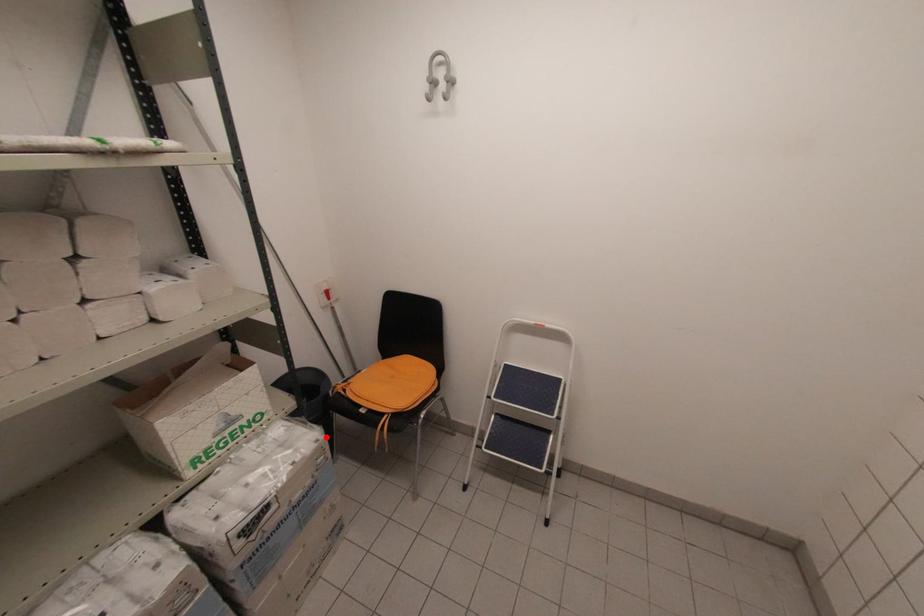
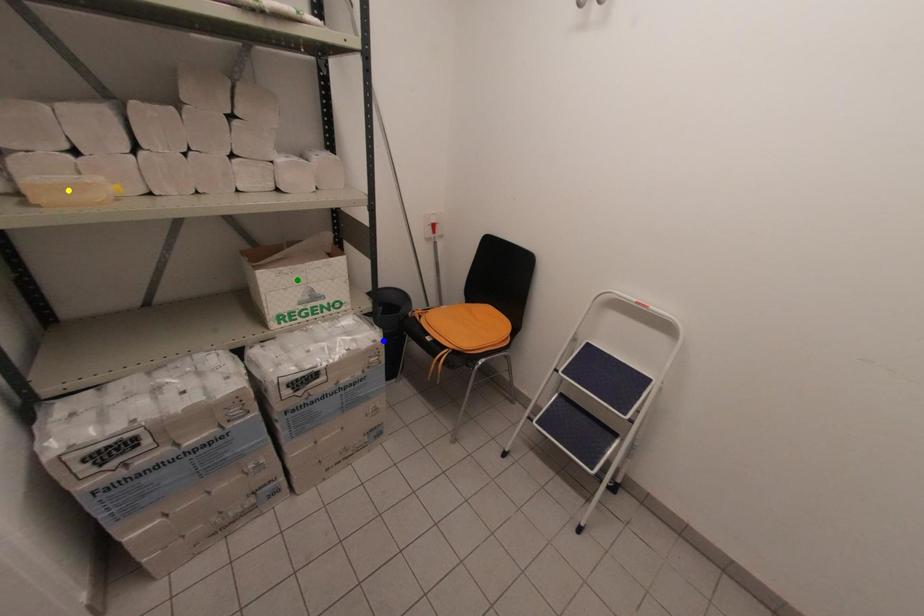
Question: I am providing you with two images of the same scene from different viewpoints. A red point is marked on the first image. You are given multiple points on the second image. Which spot in image 2 lines up with the point in image 1?

Choices:
 (A) blue point
 (B) green point
 (C) yellow point

Answer: (A)